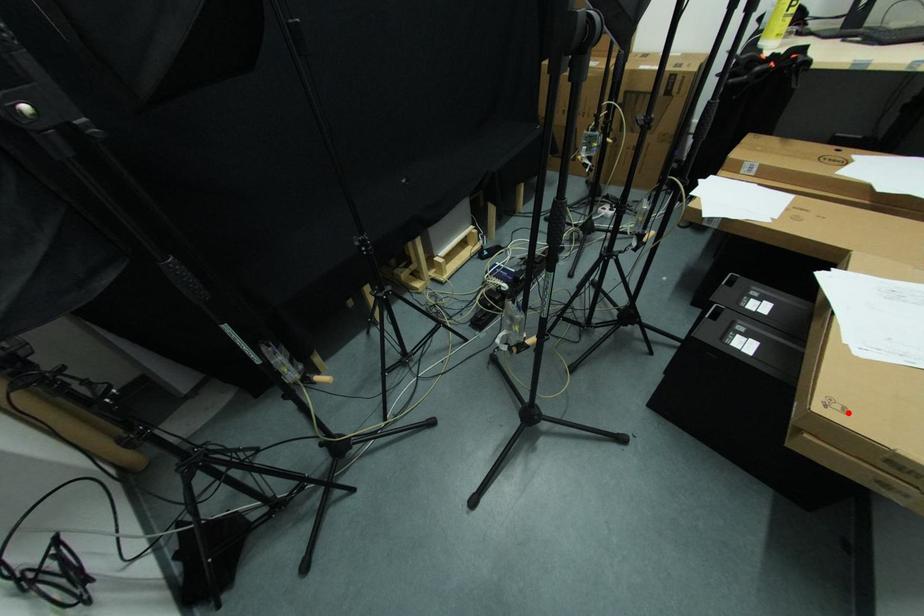
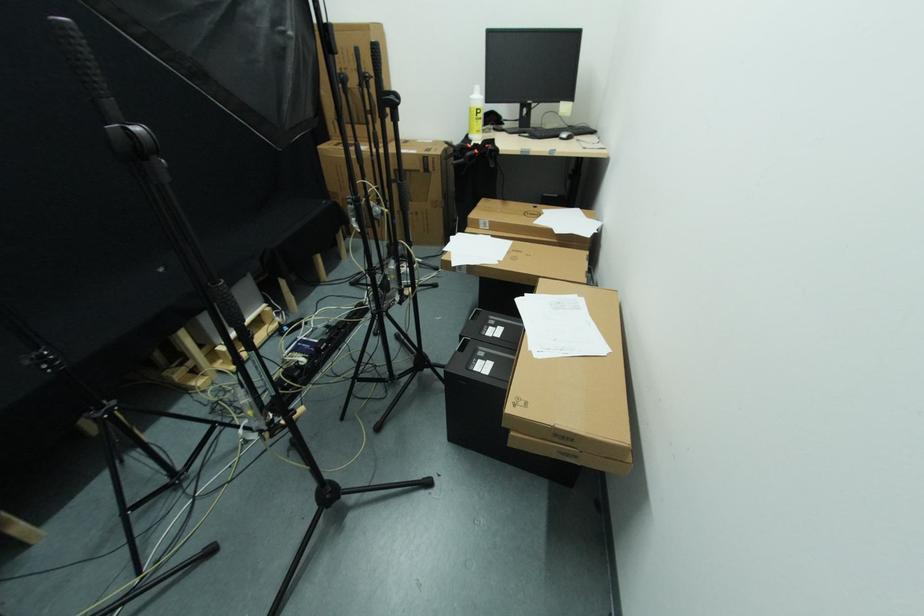
The point at the highlighted location is marked in the first image. Where is the corresponding point in the second image?

(528, 406)